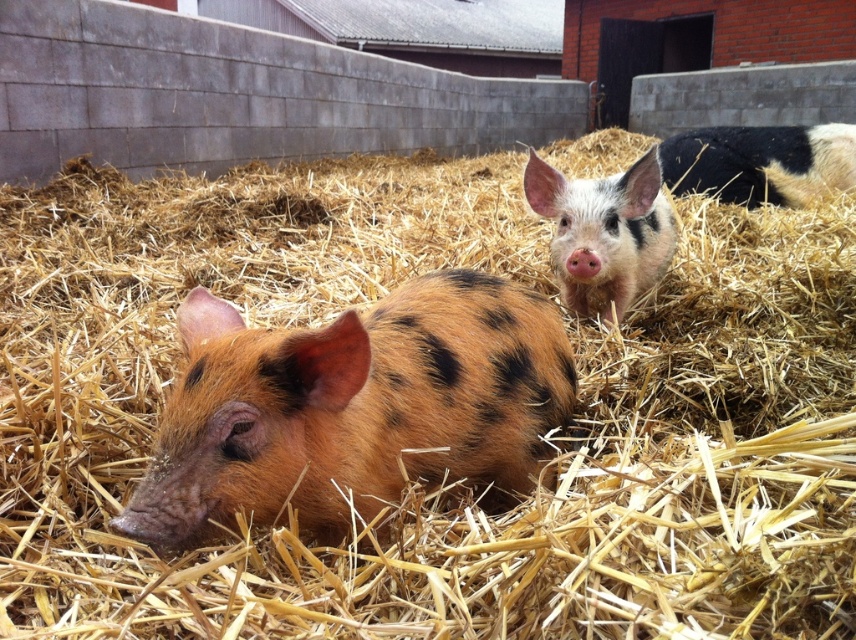
Question: Is the position of spotted fur pig at center less distant than that of spotted fur piglet at center?

Choices:
 (A) yes
 (B) no

Answer: (A)

Question: Can you confirm if spotted fur pig at center is positioned to the left of black and white spotted pig at upper right?

Choices:
 (A) no
 (B) yes

Answer: (B)

Question: Which point is closer to the camera?

Choices:
 (A) spotted fur piglet at center
 (B) spotted fur pig at center

Answer: (B)

Question: Among these objects, which one is farthest from the camera?

Choices:
 (A) black and white spotted pig at upper right
 (B) spotted fur piglet at center
 (C) spotted fur pig at center

Answer: (A)

Question: Which point appears closest to the camera in this image?

Choices:
 (A) (800, 147)
 (B) (572, 214)
 (C) (212, 378)

Answer: (C)

Question: Is spotted fur piglet at center bigger than black and white spotted pig at upper right?

Choices:
 (A) no
 (B) yes

Answer: (A)